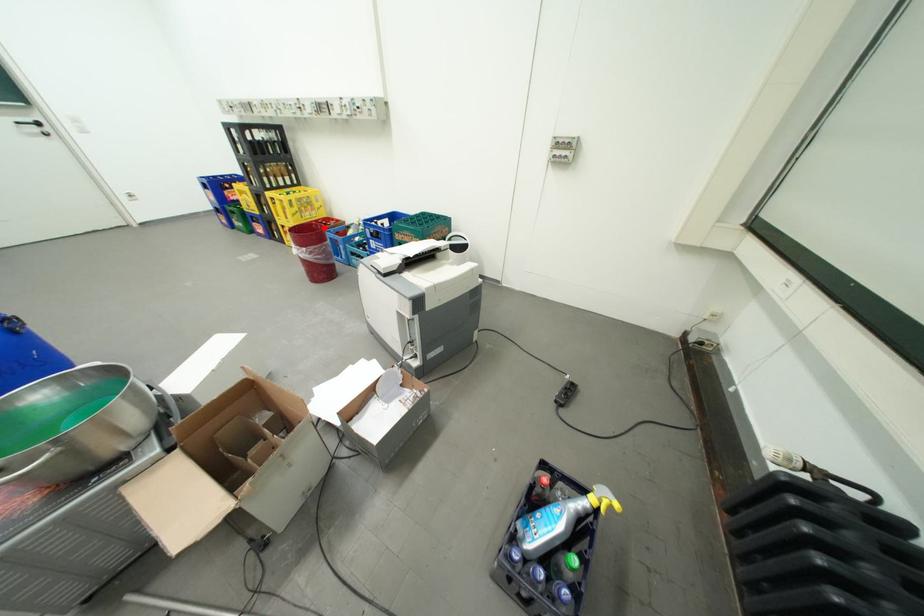
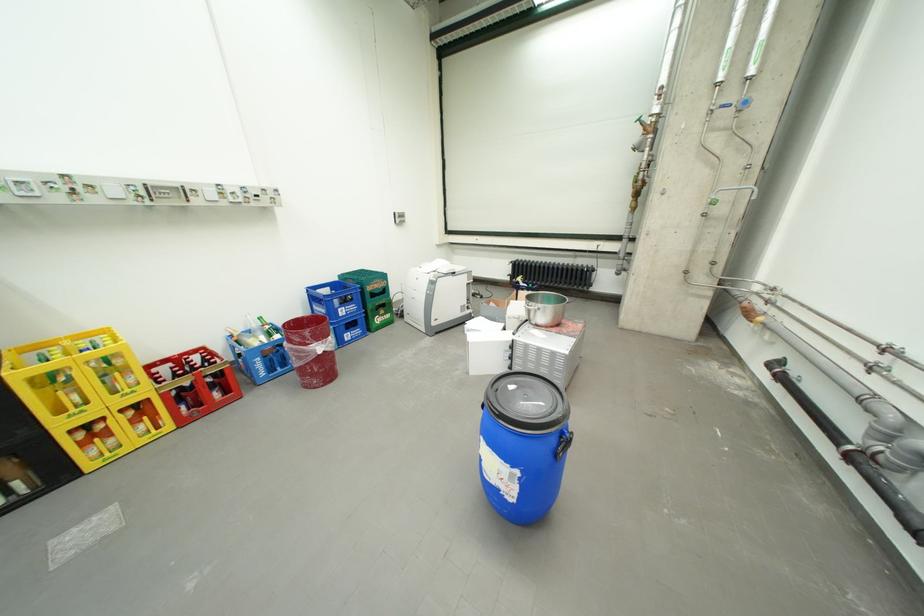
Question: I am providing you with two images of the same scene from different viewpoints. Image1 has a red point marked. In image2, the corresponding 3D location appears at what relative position? Reply with the corresponding letter.

Choices:
 (A) Closer
 (B) Farther

Answer: (B)